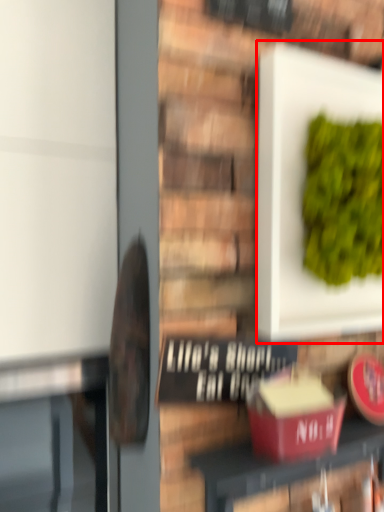
Question: From the image, what is the correct spatial relationship of square (annotated by the red box) in relation to furniture?

Choices:
 (A) right
 (B) left

Answer: (A)